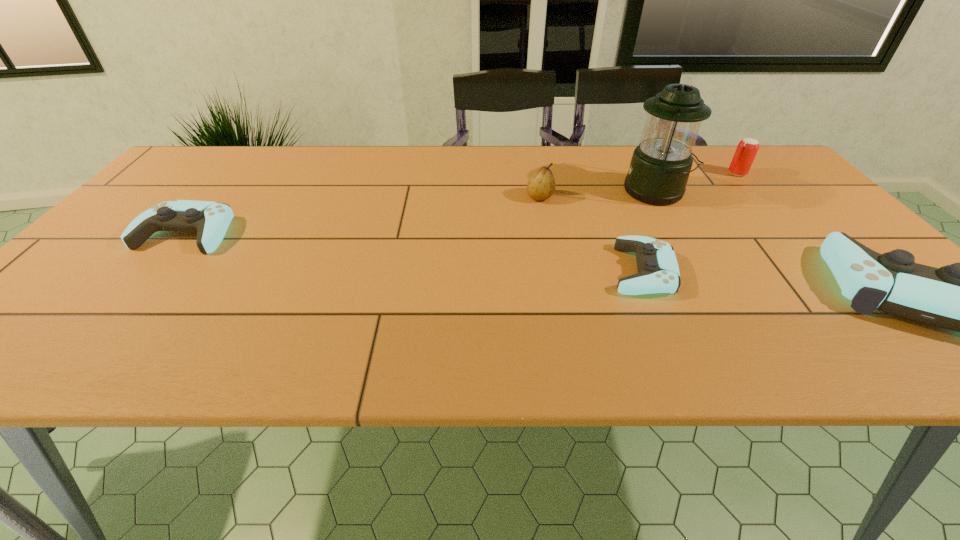
Where is `vacant position for inserting another control evenly`? The width and height of the screenshot is (960, 540). vacant position for inserting another control evenly is located at coordinates (403, 251).